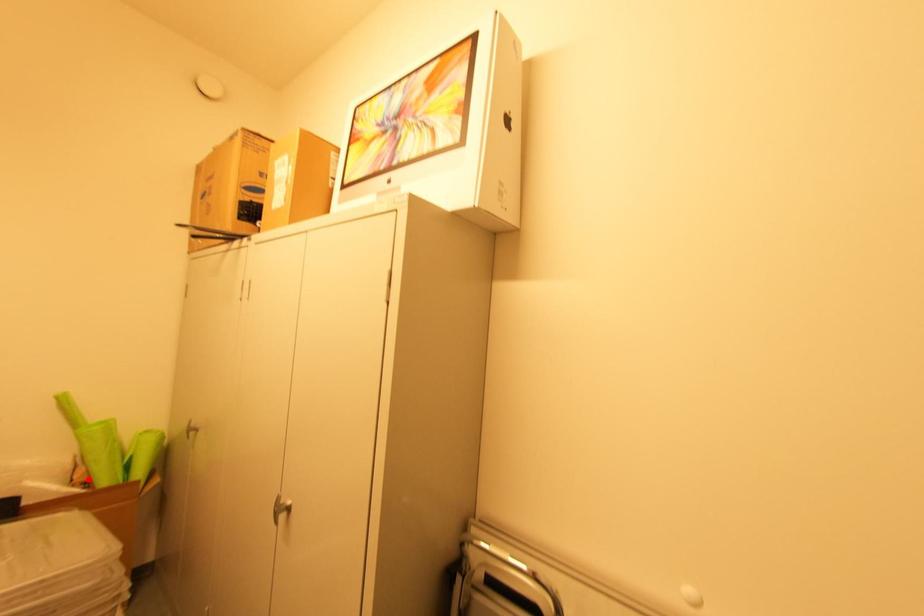
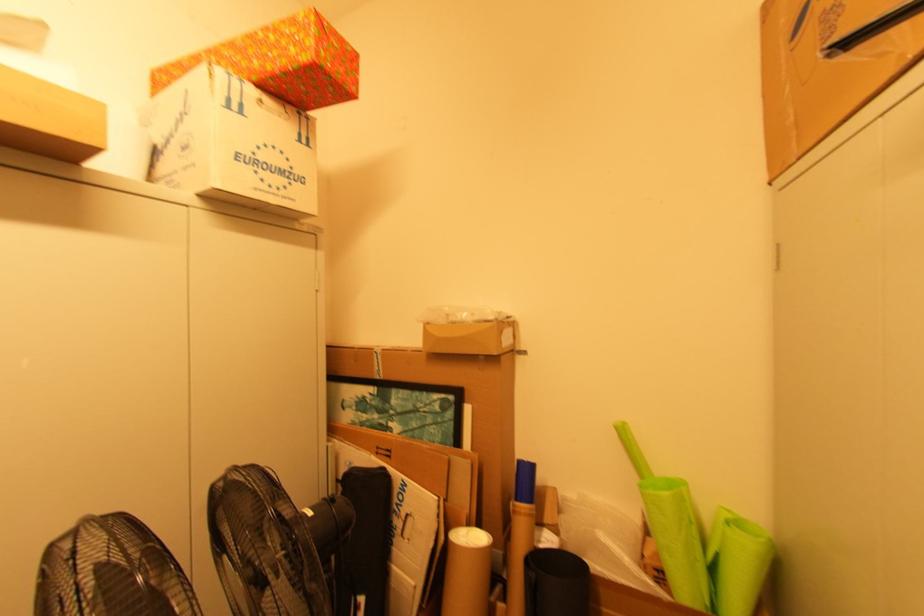
Question: I am providing you with two images of the same scene from different viewpoints. Given a red point in image1, look at the same physical point in image2. Is it:

Choices:
 (A) Closer to the viewpoint
 (B) Farther from the viewpoint

Answer: (A)